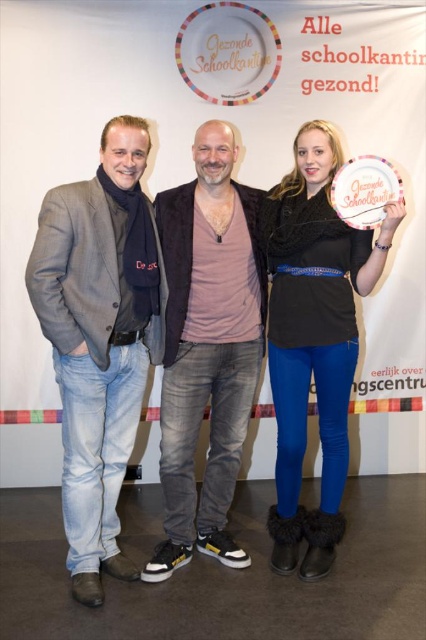
Question: Is light blue denim jeans at left closer to camera compared to matte pink shirt at center?

Choices:
 (A) yes
 (B) no

Answer: (A)

Question: Is matte pink shirt at center bigger than matte black sweater at center?

Choices:
 (A) yes
 (B) no

Answer: (B)

Question: Which of the following is the farthest from the observer?

Choices:
 (A) matte pink shirt at center
 (B) light blue denim jeans at left

Answer: (A)

Question: Is light blue denim jeans at left below matte black sweater at center?

Choices:
 (A) no
 (B) yes

Answer: (B)

Question: Which point is farther to the camera?

Choices:
 (A) (301, 323)
 (B) (123, 264)

Answer: (A)

Question: Which object appears closest to the camera in this image?

Choices:
 (A) matte black sweater at center
 (B) matte pink shirt at center

Answer: (A)